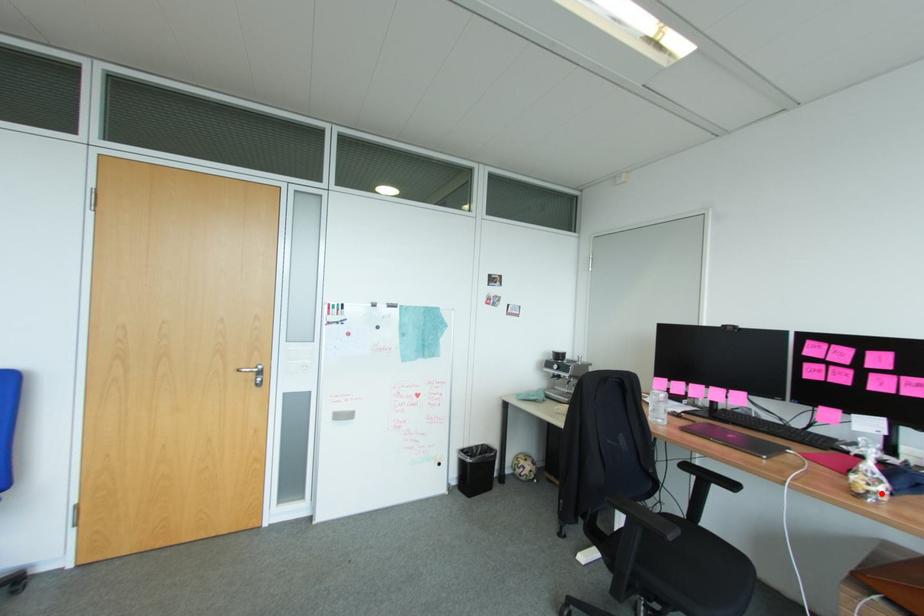
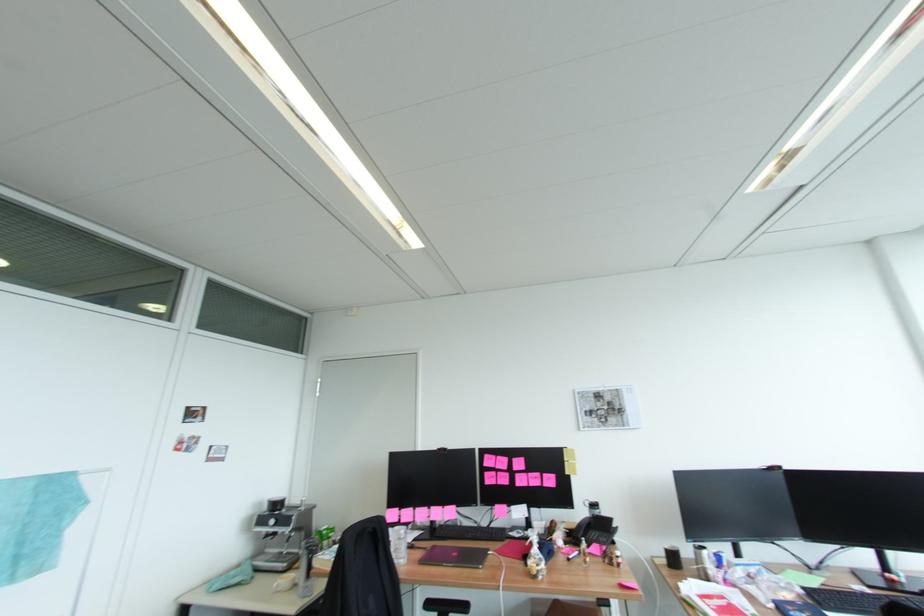
The point at the highlighted location is marked in the first image. Where is the corresponding point in the second image?

(546, 570)